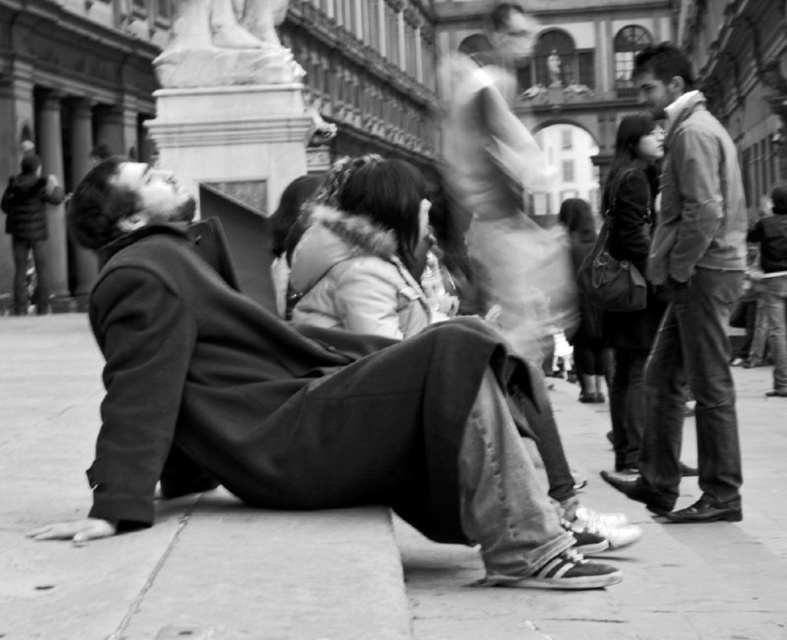
You are a photographer analyzing this scene. You notice the matte black jacket at right and the white marble statue at upper center. Which object would appear closer to the camera based on their sizes in the photo?

The matte black jacket at right is larger in size than the white marble statue at upper center, so it would appear closer to the camera since larger objects in the same frame typically indicate proximity.

You are a photographer standing at the camera position. You want to take a closeup shot of the matte black jacket at right. Can you walk towards it to get a better shot?

The matte black jacket at right is 42.12 meters away from camera. Since the distance is too far, you cannot walk towards it to get a better closeup shot.